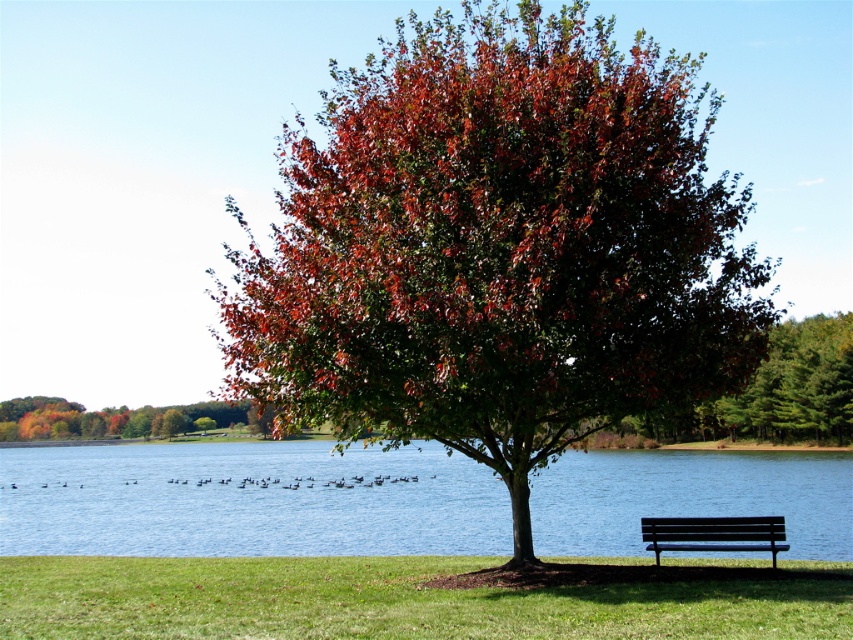
Question: Considering the relative positions of shiny reddish-brown leaves at center and black metal bench at lower right in the image provided, where is shiny reddish-brown leaves at center located with respect to black metal bench at lower right?

Choices:
 (A) left
 (B) right

Answer: (A)

Question: Which object is farther from the camera taking this photo?

Choices:
 (A) blue water at lower center
 (B) black metal bench at lower right
 (C) shiny reddish-brown leaves at center

Answer: (A)

Question: Does blue water at lower center have a smaller size compared to black metal bench at lower right?

Choices:
 (A) no
 (B) yes

Answer: (A)

Question: Which of the following is the farthest from the observer?

Choices:
 (A) (741, 536)
 (B) (747, 253)

Answer: (A)

Question: Which point is farther to the camera?

Choices:
 (A) (715, 538)
 (B) (531, 308)
 (C) (9, 524)

Answer: (C)

Question: Is blue water at lower center smaller than black metal bench at lower right?

Choices:
 (A) yes
 (B) no

Answer: (B)